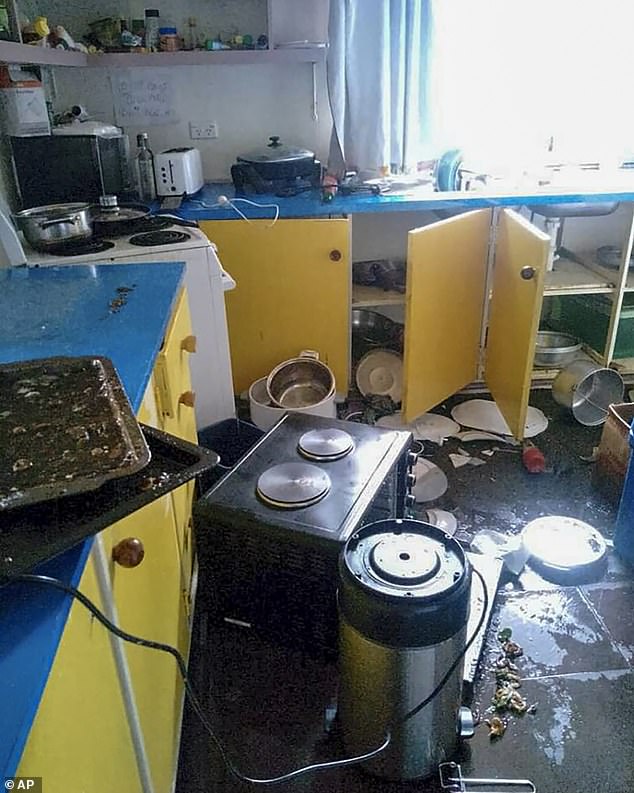
I want to click on pots, so click(68, 220), click(106, 209), click(288, 377), click(259, 389), click(581, 396).